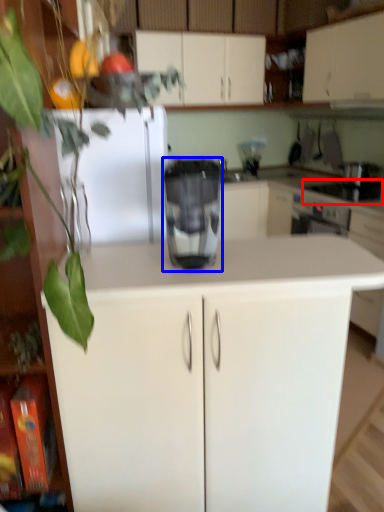
Question: Which of the following is the closest to the observer, appliance (highlighted by a red box) or home appliance (highlighted by a blue box)?

Choices:
 (A) appliance
 (B) home appliance

Answer: (B)